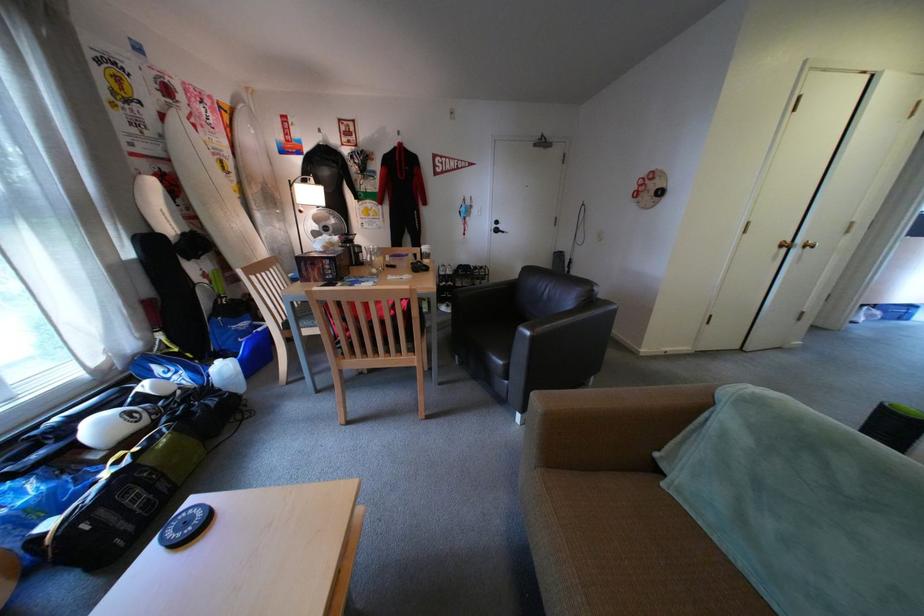
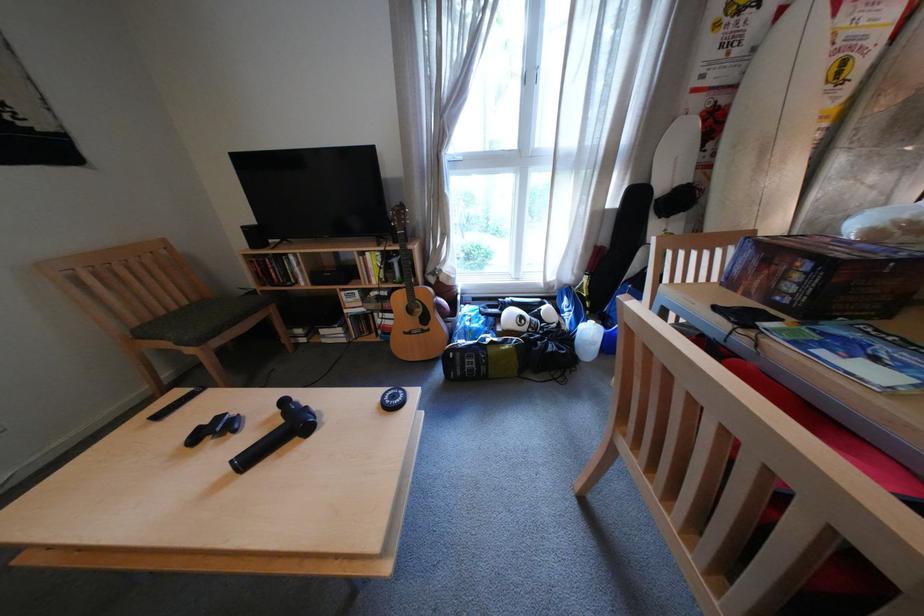
Locate, in the second image, the point that corresponds to (213,378) in the first image.

(589, 326)